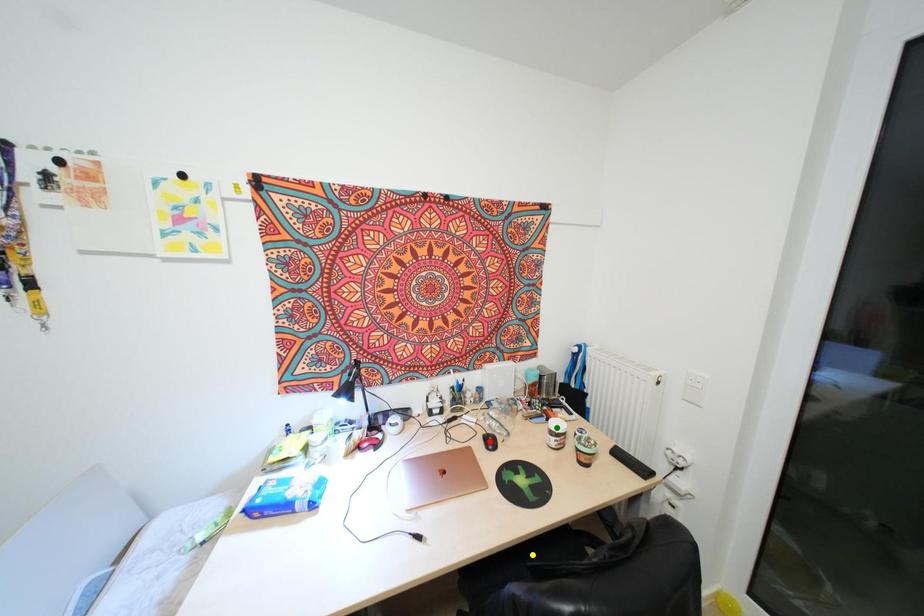
Order these from nearest to farthest:
- yellow point
- red point
- green point

1. yellow point
2. red point
3. green point